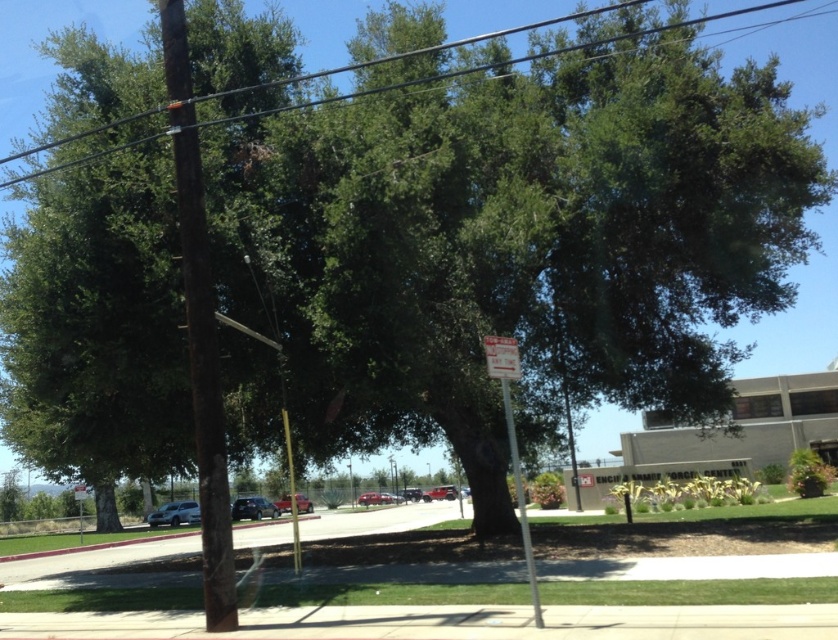
Between green leafy tree at upper center and white paper sign at center, which one appears on the right side from the viewer's perspective?

From the viewer's perspective, white paper sign at center appears more on the right side.

Is point (769, 26) farther from camera compared to point (507, 387)?

That is True.

At what (x,y) coordinates should I click in order to perform the action: click on green leafy tree at upper center. Please return your answer as a coordinate pair (x, y). Looking at the image, I should click on click(626, 36).

Can you confirm if brown wooden telegraph pole at left is bigger than green leafy tree at upper center?

Incorrect, brown wooden telegraph pole at left is not larger than green leafy tree at upper center.

Based on the photo, who is positioned more to the left, brown wooden telegraph pole at left or green leafy tree at upper center?

Positioned to the left is brown wooden telegraph pole at left.

Locate an element on the screen. The height and width of the screenshot is (640, 838). brown wooden telegraph pole at left is located at coordinates (199, 326).

The height and width of the screenshot is (640, 838). I want to click on satin silver suv at lower left, so click(174, 513).

What do you see at coordinates (174, 513) in the screenshot? The height and width of the screenshot is (640, 838). I see `satin silver suv at lower left` at bounding box center [174, 513].

At what (x,y) coordinates should I click in order to perform the action: click on satin silver suv at lower left. Please return your answer as a coordinate pair (x, y). Looking at the image, I should click on (174, 513).